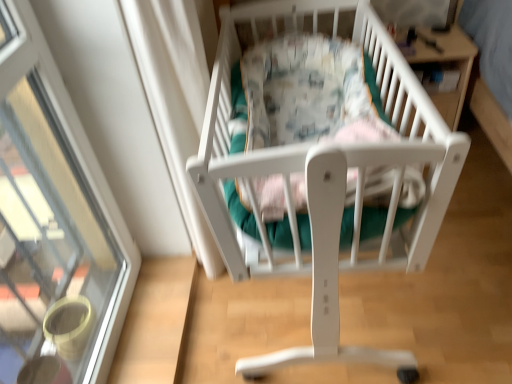
At what (x,y) coordinates should I click in order to perform the action: click on transparent glass door at upper left. Please return your answer as a coordinate pair (x, y). Image resolution: width=512 pixels, height=384 pixels. Looking at the image, I should click on (54, 217).

I want to click on white matte infant bed at center, so click(322, 171).

Relative to white matte infant bed at center, is wooden table at upper right in front or behind?

Visually, wooden table at upper right is located behind white matte infant bed at center.

Is wooden table at upper right to the right of white matte infant bed at center from the viewer's perspective?

Yes.

Can you confirm if wooden table at upper right is thinner than white matte infant bed at center?

Correct, the width of wooden table at upper right is less than that of white matte infant bed at center.

Is wooden table at upper right touching white matte infant bed at center?

No.

In the image, there is a transparent glass door at upper left. Where is `table below it (from a real-world perspective)`? table below it (from a real-world perspective) is located at coordinates (447, 67).

Measure the distance between wooden table at upper right and transparent glass door at upper left.

The distance of wooden table at upper right from transparent glass door at upper left is 1.66 meters.

Does wooden table at upper right touch transparent glass door at upper left?

No, wooden table at upper right is not making contact with transparent glass door at upper left.

From the image's perspective, which is below, wooden table at upper right or transparent glass door at upper left?

transparent glass door at upper left, from the image's perspective.

In the image, there is a transparent glass door at upper left. Identify the location of infant bed below it (from a real-world perspective). The height and width of the screenshot is (384, 512). (322, 171).

Does transparent glass door at upper left lie behind white matte infant bed at center?

No, the depth of transparent glass door at upper left is less than that of white matte infant bed at center.

Is transparent glass door at upper left smaller than white matte infant bed at center?

Yes, transparent glass door at upper left is smaller than white matte infant bed at center.

Considering the relative positions of white matte infant bed at center and wooden table at upper right in the image provided, is white matte infant bed at center behind wooden table at upper right?

No.

Can you tell me how much white matte infant bed at center and wooden table at upper right differ in facing direction?

89.4 degrees separate the facing orientations of white matte infant bed at center and wooden table at upper right.

Is white matte infant bed at center completely or partially outside of wooden table at upper right?

Absolutely, white matte infant bed at center is external to wooden table at upper right.

Is white matte infant bed at center touching wooden table at upper right?

No, white matte infant bed at center is not with wooden table at upper right.

Is transparent glass door at upper left aimed at wooden table at upper right?

No, transparent glass door at upper left is not facing towards wooden table at upper right.

What's the angular difference between transparent glass door at upper left and wooden table at upper right's facing directions?

90.1 degrees.

Is transparent glass door at upper left wider than wooden table at upper right?

No, transparent glass door at upper left is not wider than wooden table at upper right.

Is transparent glass door at upper left positioned beyond the bounds of wooden table at upper right?

Yes, transparent glass door at upper left is located beyond the bounds of wooden table at upper right.

Considering the sizes of objects white matte infant bed at center and transparent glass door at upper left in the image provided, who is taller, white matte infant bed at center or transparent glass door at upper left?

transparent glass door at upper left.

Would you say transparent glass door at upper left is part of white matte infant bed at center's contents?

No, transparent glass door at upper left is not inside white matte infant bed at center.

Is point (294, 181) closer or farther from the camera than point (80, 140)?

Point (294, 181) appears to be closer to the viewer than point (80, 140).

Which is in front, white matte infant bed at center or transparent glass door at upper left?

Positioned in front is transparent glass door at upper left.

This screenshot has width=512, height=384. Find the location of `infant bed that is under the wooden table at upper right (from a real-world perspective)`. infant bed that is under the wooden table at upper right (from a real-world perspective) is located at coordinates (322, 171).

Where is `glass door that is in front of the wooden table at upper right`? The height and width of the screenshot is (384, 512). glass door that is in front of the wooden table at upper right is located at coordinates (54, 217).

Based on their spatial positions, is wooden table at upper right or white matte infant bed at center further from transparent glass door at upper left?

The object further to transparent glass door at upper left is wooden table at upper right.

Which object lies further to the anchor point wooden table at upper right, white matte infant bed at center or transparent glass door at upper left?

Based on the image, transparent glass door at upper left appears to be further to wooden table at upper right.

Looking at the image, which one is located further to white matte infant bed at center, wooden table at upper right or transparent glass door at upper left?

wooden table at upper right lies further to white matte infant bed at center than the other object.

Considering their positions, is white matte infant bed at center positioned further to transparent glass door at upper left than wooden table at upper right?

wooden table at upper right lies further to transparent glass door at upper left than the other object.

Looking at this image, when comparing their distances from white matte infant bed at center, does transparent glass door at upper left or wooden table at upper right seem further?

Based on the image, wooden table at upper right appears to be further to white matte infant bed at center.

Looking at the image, which one is located closer to wooden table at upper right, transparent glass door at upper left or white matte infant bed at center?

white matte infant bed at center is closer to wooden table at upper right.

The image size is (512, 384). What are the coordinates of `infant bed located between transparent glass door at upper left and wooden table at upper right in the left-right direction` in the screenshot? It's located at pos(322,171).